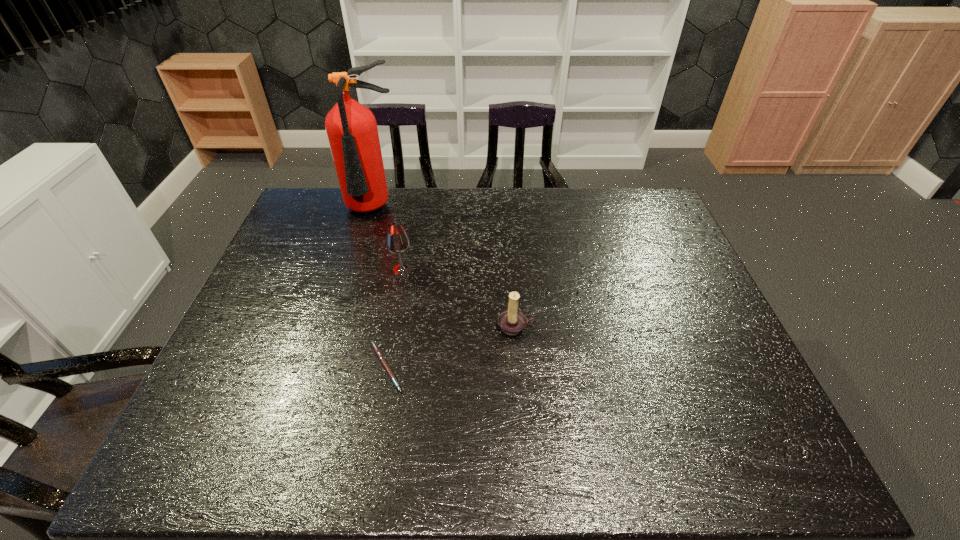
Where is `free space located 0.220m at the nib of the pen`? free space located 0.220m at the nib of the pen is located at coordinates (497, 367).

Where is `object that is positioned at the far edge`? object that is positioned at the far edge is located at coordinates (351, 128).

Where is `object that is positioned at the left edge`? object that is positioned at the left edge is located at coordinates (351, 128).

Image resolution: width=960 pixels, height=540 pixels. Identify the location of object present at the far left corner. (351, 128).

In the image, there is a desktop. At what (x,y) coordinates should I click in order to perform the action: click on blank space at the far edge. Please return your answer as a coordinate pair (x, y). Looking at the image, I should click on (519, 217).

At what (x,y) coordinates should I click in order to perform the action: click on free space at the near edge of the desktop. Please return your answer as a coordinate pair (x, y). Looking at the image, I should click on (512, 463).

Locate an element on the screen. The image size is (960, 540). blank space at the left edge of the desktop is located at coordinates (309, 251).

You are a GUI agent. You are given a task and a screenshot of the screen. Output one action in this format:
    pyautogui.click(x=<x>, y=<y>)
    Task: Click on the free region at the right edge of the desktop
    Image resolution: width=960 pixels, height=540 pixels.
    Given the screenshot: What is the action you would take?
    pyautogui.click(x=721, y=368)

This screenshot has height=540, width=960. What are the coordinates of `free space at the far left corner of the desktop` in the screenshot? It's located at (286, 228).

Where is `free region at the near left corner`? Image resolution: width=960 pixels, height=540 pixels. free region at the near left corner is located at coordinates (224, 434).